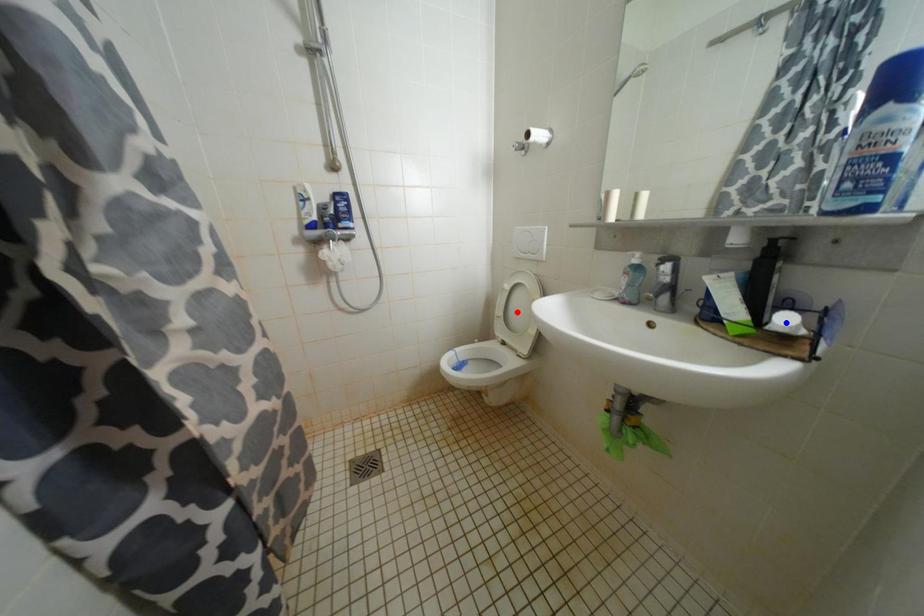
Question: In the image, two points are highlighted. Which point is nearer to the camera? Reply with the corresponding letter.

Choices:
 (A) blue point
 (B) red point

Answer: (A)